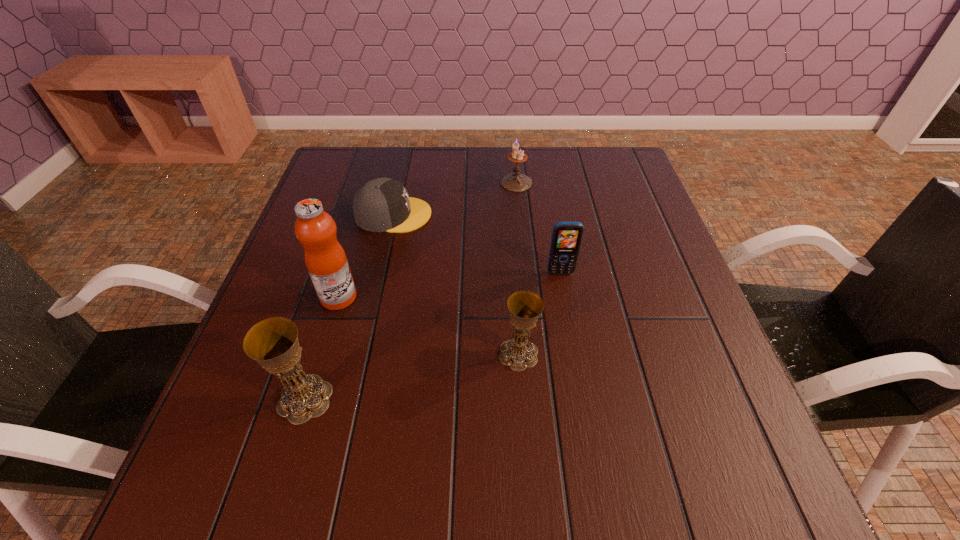
The height and width of the screenshot is (540, 960). Identify the location of the third farthest object. (566, 239).

At what (x,y) coordinates should I click in order to perform the action: click on vacant space located on the back of the left chalice. Please return your answer as a coordinate pair (x, y). The width and height of the screenshot is (960, 540). Looking at the image, I should click on (333, 305).

You are a GUI agent. You are given a task and a screenshot of the screen. Output one action in this format:
    pyautogui.click(x=<x>, y=<y>)
    Task: Click on the free space located on the left of the shorter chalice
    This screenshot has width=960, height=540.
    Given the screenshot: What is the action you would take?
    pyautogui.click(x=458, y=354)

Where is `vacant space located 0.280m on the right of the farthest object`? The image size is (960, 540). vacant space located 0.280m on the right of the farthest object is located at coordinates (630, 183).

Locate an element on the screen. Image resolution: width=960 pixels, height=540 pixels. free spot located 0.190m on the front-facing side of the second farthest object is located at coordinates (504, 214).

Locate an element on the screen. free spot located on the front label of the tallest object is located at coordinates (499, 298).

At what (x,y) coordinates should I click in order to perform the action: click on free point located on the screen of the rightmost object. Please return your answer as a coordinate pair (x, y). This screenshot has width=960, height=540. Looking at the image, I should click on (587, 421).

Locate an element on the screen. The image size is (960, 540). object that is at the far edge is located at coordinates [516, 182].

The image size is (960, 540). Identify the location of object present at the near edge. (273, 343).

Identify the location of chalice located at the left edge. The image size is (960, 540). (273, 343).